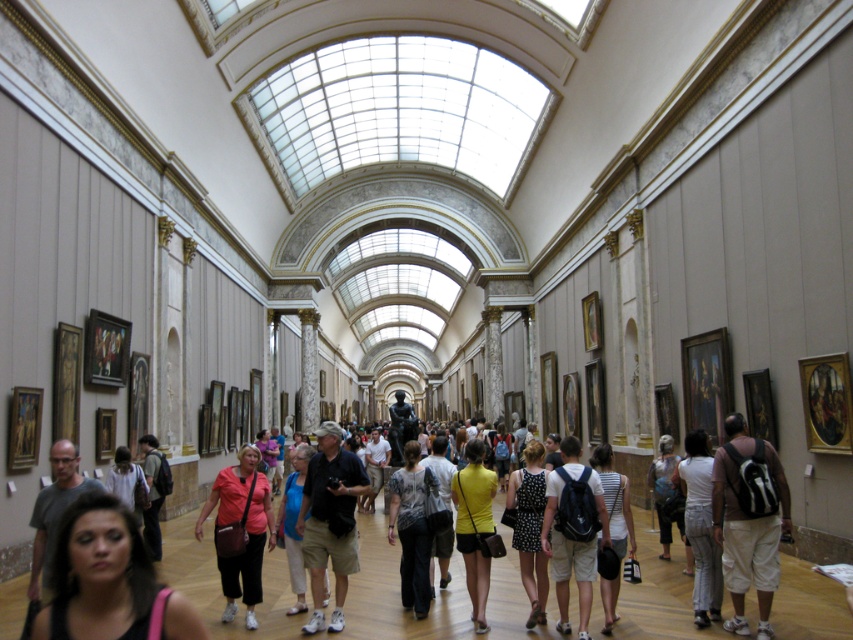
You are standing in the grand gallery hall and want to move from point (x=674, y=476) to point (x=529, y=467). Which direction should you move to get closer to your destination?

You should move forward because point (x=674, y=476) is closer to you than point (x=529, y=467), so moving forward will take you toward the destination.

You are a photographer planning to take a portrait of two people wearing the matte black top at center and the polka dot dress at center. Since you want to ensure both subjects are clearly visible, which clothing item should you position closer to the camera to avoid being obscured by the other?

The matte black top at center has a lesser width compared to the polka dot dress at center, so positioning the person wearing the matte black top at center closer to the camera will prevent it from being obscured by the wider polka dot dress at center.